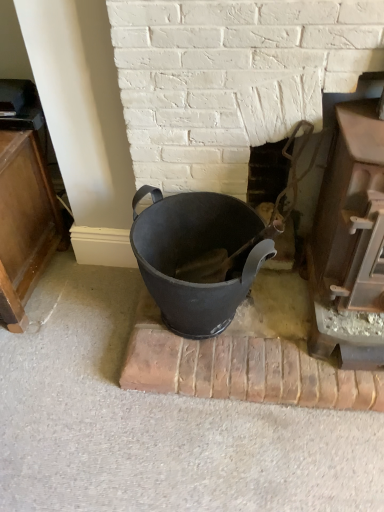
What do you see at coordinates (196, 256) in the screenshot?
I see `matte black bucket at center` at bounding box center [196, 256].

What is the approximate width of matte black bucket at center?

The width of matte black bucket at center is 14.51 inches.

From the picture: Measure the distance between smooth black bucket at center, the 1th fireplace positioned from the left, and camera.

They are 33.60 inches apart.

This screenshot has height=512, width=384. Find the location of `smooth brown wood at right, the 1th fireplace positioned from the right`. smooth brown wood at right, the 1th fireplace positioned from the right is located at coordinates (350, 236).

This screenshot has width=384, height=512. Identify the location of fireplace that is the 1st object located above the smooth brown wood at right, which ranks as the 3th fireplace in left-to-right order (from the image's perspective). (280, 187).

Is smooth metal fireplace at center, marked as the second fireplace in a left-to-right arrangement, taller than smooth brown wood at right, which ranks as the 3th fireplace in left-to-right order?

Incorrect, the height of smooth metal fireplace at center, marked as the second fireplace in a left-to-right arrangement, is not larger of that of smooth brown wood at right, which ranks as the 3th fireplace in left-to-right order.

Based on the photo, is smooth metal fireplace at center, marked as the second fireplace in a left-to-right arrangement, bigger or smaller than smooth brown wood at right, the 1th fireplace positioned from the right?

smooth metal fireplace at center, marked as the second fireplace in a left-to-right arrangement, is smaller than smooth brown wood at right, the 1th fireplace positioned from the right.

Between point (275, 154) and point (347, 358), which one is positioned in front?

The point (347, 358) is in front.

Considering the positions of point (238, 114) and point (157, 304), is point (238, 114) closer or farther from the camera than point (157, 304)?

Clearly, point (238, 114) is closer to the camera than point (157, 304).

Considering the sizes of smooth black bucket at center, which is counted as the 3th fireplace, starting from the right, and matte black bucket at center in the image, is smooth black bucket at center, which is counted as the 3th fireplace, starting from the right, taller or shorter than matte black bucket at center?

smooth black bucket at center, which is counted as the 3th fireplace, starting from the right, is taller than matte black bucket at center.

Is smooth black bucket at center, which is counted as the 3th fireplace, starting from the right, in front of or behind matte black bucket at center in the image?

Visually, smooth black bucket at center, which is counted as the 3th fireplace, starting from the right, is located in front of matte black bucket at center.

Which object is positioned more to the left, smooth black bucket at center, the 1th fireplace positioned from the left, or matte black bucket at center?

matte black bucket at center.

Is smooth black bucket at center, the 1th fireplace positioned from the left, outside of smooth metal fireplace at center, marked as the second fireplace in a right-to-left arrangement?

Indeed, smooth black bucket at center, the 1th fireplace positioned from the left, is completely outside smooth metal fireplace at center, marked as the second fireplace in a right-to-left arrangement.

From a real-world perspective, relative to smooth metal fireplace at center, marked as the second fireplace in a left-to-right arrangement, is smooth black bucket at center, which is counted as the 3th fireplace, starting from the right, vertically above or below?

smooth black bucket at center, which is counted as the 3th fireplace, starting from the right, is situated higher than smooth metal fireplace at center, marked as the second fireplace in a left-to-right arrangement, in the real world.

Considering the relative sizes of smooth black bucket at center, which is counted as the 3th fireplace, starting from the right, and smooth metal fireplace at center, marked as the second fireplace in a right-to-left arrangement, in the image provided, is smooth black bucket at center, which is counted as the 3th fireplace, starting from the right, taller than smooth metal fireplace at center, marked as the second fireplace in a right-to-left arrangement,?

Correct, smooth black bucket at center, which is counted as the 3th fireplace, starting from the right, is much taller as smooth metal fireplace at center, marked as the second fireplace in a right-to-left arrangement.

What's the angular difference between smooth black bucket at center, the 1th fireplace positioned from the left, and smooth metal fireplace at center, marked as the second fireplace in a right-to-left arrangement,'s facing directions?

The angular difference between smooth black bucket at center, the 1th fireplace positioned from the left, and smooth metal fireplace at center, marked as the second fireplace in a right-to-left arrangement, is 0.868 degrees.

Can you confirm if smooth metal fireplace at center, marked as the second fireplace in a left-to-right arrangement, is bigger than matte black bucket at center?

No, smooth metal fireplace at center, marked as the second fireplace in a left-to-right arrangement, is not bigger than matte black bucket at center.

How distant is smooth metal fireplace at center, marked as the second fireplace in a left-to-right arrangement, from matte black bucket at center?

→ They are 12.12 inches apart.

From the picture: Is smooth metal fireplace at center, marked as the second fireplace in a right-to-left arrangement, taller than matte black bucket at center?

Indeed, smooth metal fireplace at center, marked as the second fireplace in a right-to-left arrangement, has a greater height compared to matte black bucket at center.

Is smooth metal fireplace at center, marked as the second fireplace in a right-to-left arrangement, positioned behind matte black bucket at center?

Yes, smooth metal fireplace at center, marked as the second fireplace in a right-to-left arrangement, is behind matte black bucket at center.

The width and height of the screenshot is (384, 512). I want to click on crock pot behind the smooth black bucket at center, which is counted as the 3th fireplace, starting from the right, so click(196, 256).

Between matte black bucket at center and smooth black bucket at center, the 1th fireplace positioned from the left, which one has larger size?

Bigger between the two is matte black bucket at center.

Measure the distance from matte black bucket at center to smooth black bucket at center, which is counted as the 3th fireplace, starting from the right.

8.87 inches.

Does point (289, 155) appear closer or farther from the camera than point (230, 18)?

Point (289, 155) is positioned farther from the camera compared to point (230, 18).

From a real-world perspective, is smooth metal fireplace at center, marked as the second fireplace in a left-to-right arrangement, on top of smooth black bucket at center, the 1th fireplace positioned from the left?

No, from a real-world perspective, smooth metal fireplace at center, marked as the second fireplace in a left-to-right arrangement, is not over smooth black bucket at center, the 1th fireplace positioned from the left

From the image's perspective, is smooth metal fireplace at center, marked as the second fireplace in a left-to-right arrangement, positioned above or below smooth black bucket at center, which is counted as the 3th fireplace, starting from the right?

Based on their image positions, smooth metal fireplace at center, marked as the second fireplace in a left-to-right arrangement, is located beneath smooth black bucket at center, which is counted as the 3th fireplace, starting from the right.

Which of these two, matte black bucket at center or smooth brown wood at right, which ranks as the 3th fireplace in left-to-right order, stands taller?

Standing taller between the two is smooth brown wood at right, which ranks as the 3th fireplace in left-to-right order.

Is point (200, 242) positioned in front of point (345, 222)?

No.

Identify the location of the 3rd fireplace counting from the right of the matte black bucket at center. (350, 236).

From a real-world perspective, is matte black bucket at center physically located above or below smooth brown wood at right, the 1th fireplace positioned from the right?

In terms of real-world spatial position, matte black bucket at center is below smooth brown wood at right, the 1th fireplace positioned from the right.

I want to click on the 2nd fireplace in front of the smooth metal fireplace at center, marked as the second fireplace in a left-to-right arrangement, counting from the anchor's position, so click(x=350, y=236).

In order to click on crock pot behind the smooth black bucket at center, the 1th fireplace positioned from the left in this screenshot , I will do `click(196, 256)`.

Looking at this image, which object lies nearer to the anchor point matte black bucket at center, smooth brown wood at right, the 1th fireplace positioned from the right, or smooth black bucket at center, which is counted as the 3th fireplace, starting from the right?

smooth black bucket at center, which is counted as the 3th fireplace, starting from the right.

Based on their spatial positions, is matte black bucket at center or smooth black bucket at center, which is counted as the 3th fireplace, starting from the right, further from smooth brown wood at right, the 1th fireplace positioned from the right?

smooth black bucket at center, which is counted as the 3th fireplace, starting from the right, lies further to smooth brown wood at right, the 1th fireplace positioned from the right, than the other object.

Estimate the real-world distances between objects in this image. Which object is further from matte black bucket at center, smooth black bucket at center, which is counted as the 3th fireplace, starting from the right, or smooth brown wood at right, the 1th fireplace positioned from the right?

smooth brown wood at right, the 1th fireplace positioned from the right, is further to matte black bucket at center.

When comparing their distances from smooth black bucket at center, which is counted as the 3th fireplace, starting from the right, does smooth metal fireplace at center, marked as the second fireplace in a left-to-right arrangement, or matte black bucket at center seem further?

Based on the image, smooth metal fireplace at center, marked as the second fireplace in a left-to-right arrangement, appears to be further to smooth black bucket at center, which is counted as the 3th fireplace, starting from the right.

From the image, which object appears to be farther from smooth metal fireplace at center, marked as the second fireplace in a left-to-right arrangement, smooth black bucket at center, the 1th fireplace positioned from the left, or matte black bucket at center?

The object further to smooth metal fireplace at center, marked as the second fireplace in a left-to-right arrangement, is matte black bucket at center.

Looking at the image, which one is located further to smooth metal fireplace at center, marked as the second fireplace in a right-to-left arrangement, matte black bucket at center or smooth brown wood at right, the 1th fireplace positioned from the right?

Among the two, matte black bucket at center is located further to smooth metal fireplace at center, marked as the second fireplace in a right-to-left arrangement.

Looking at the image, which one is located closer to smooth black bucket at center, the 1th fireplace positioned from the left, smooth metal fireplace at center, marked as the second fireplace in a left-to-right arrangement, or smooth brown wood at right, the 1th fireplace positioned from the right?

smooth metal fireplace at center, marked as the second fireplace in a left-to-right arrangement, is closer to smooth black bucket at center, the 1th fireplace positioned from the left.

Which object lies nearer to the anchor point smooth black bucket at center, the 1th fireplace positioned from the left, matte black bucket at center or smooth metal fireplace at center, marked as the second fireplace in a right-to-left arrangement?

Among the two, matte black bucket at center is located nearer to smooth black bucket at center, the 1th fireplace positioned from the left.

Locate an element on the screen. fireplace between smooth black bucket at center, which is counted as the 3th fireplace, starting from the right, and smooth brown wood at right, which ranks as the 3th fireplace in left-to-right order, from left to right is located at coordinates (280, 187).